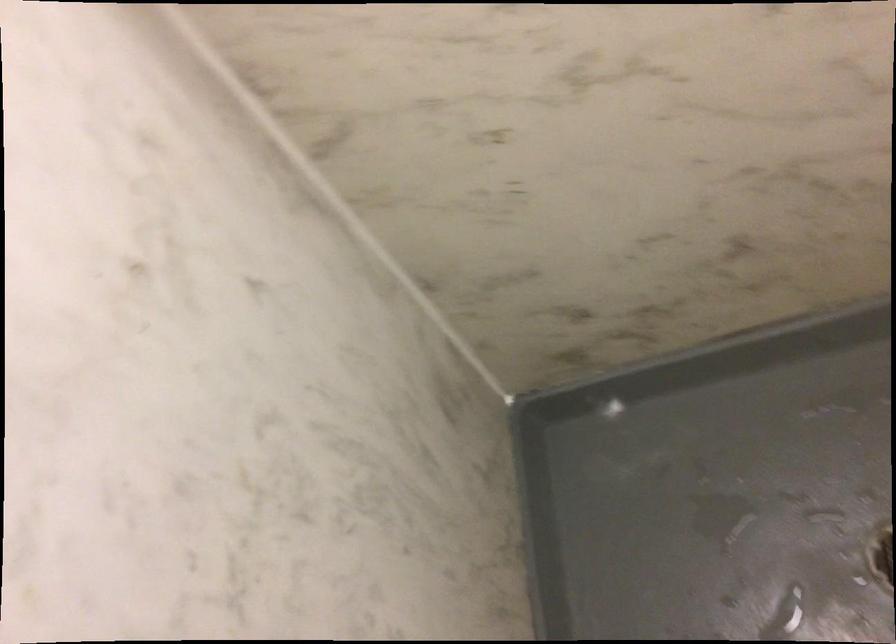
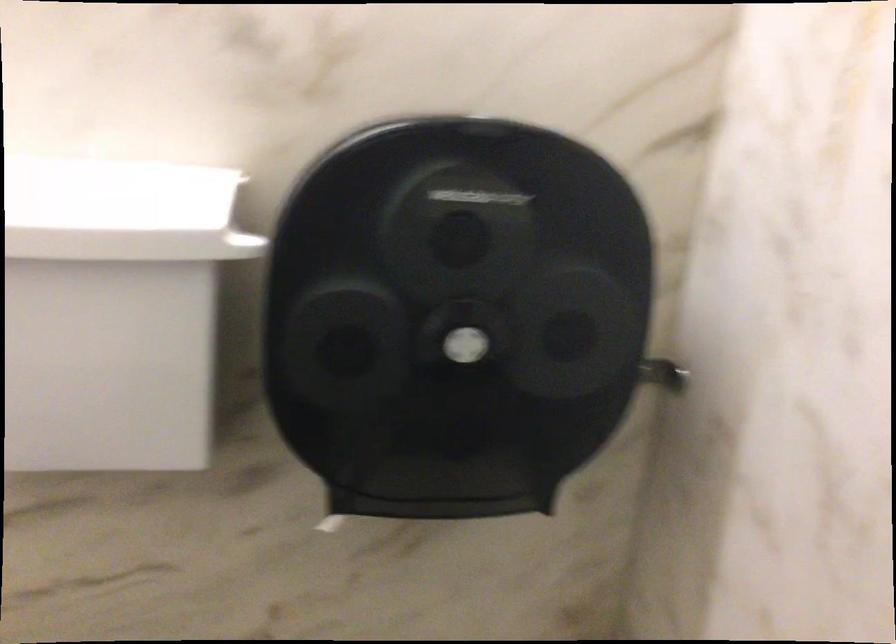
Question: The camera is either moving clockwise (left) or counter-clockwise (right) around the object. The first image is from the beginning of the video and the second image is from the end. Is the camera moving left or right when shooting the video?

Choices:
 (A) Left
 (B) Right

Answer: (A)